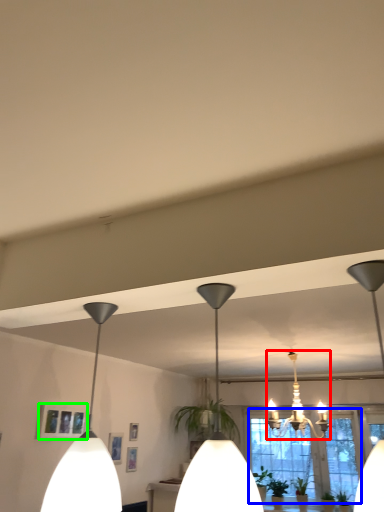
Question: Which object is positioned closest to lamp (highlighted by a red box)? Select from window (highlighted by a blue box) and picture frame (highlighted by a green box).

Choices:
 (A) window
 (B) picture frame

Answer: (A)